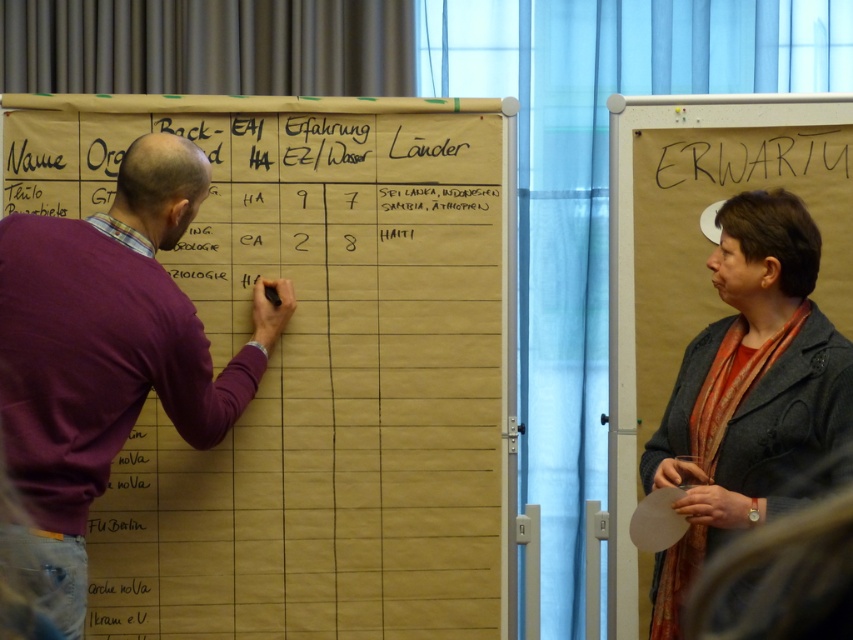
Is point (115, 416) positioned behind point (705, 554)?

No.

The width and height of the screenshot is (853, 640). What do you see at coordinates (109, 346) in the screenshot?
I see `purple sweater at left` at bounding box center [109, 346].

Identify the location of purple sweater at left. (109, 346).